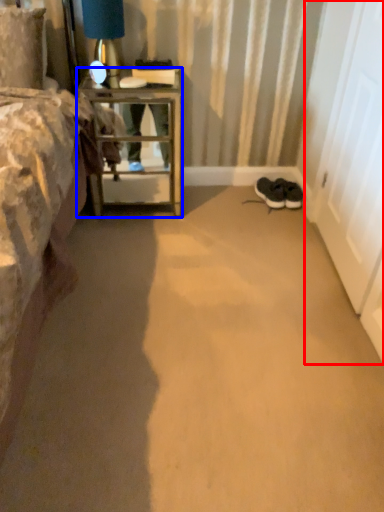
Question: Among these objects, which one is nearest to the camera, screen door (highlighted by a red box) or nightstand (highlighted by a blue box)?

Choices:
 (A) screen door
 (B) nightstand

Answer: (A)